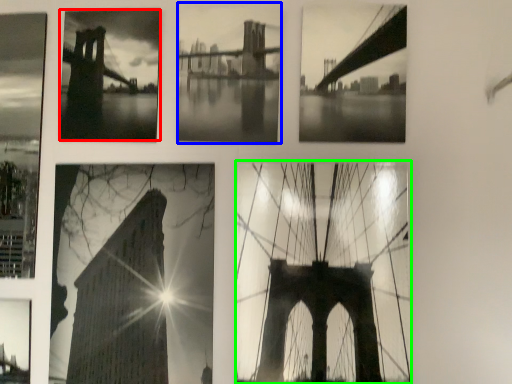
Question: Which object is the farthest from picture frame (highlighted by a red box)? Choose among these: picture frame (highlighted by a blue box) or picture frame (highlighted by a green box).

Choices:
 (A) picture frame
 (B) picture frame

Answer: (B)